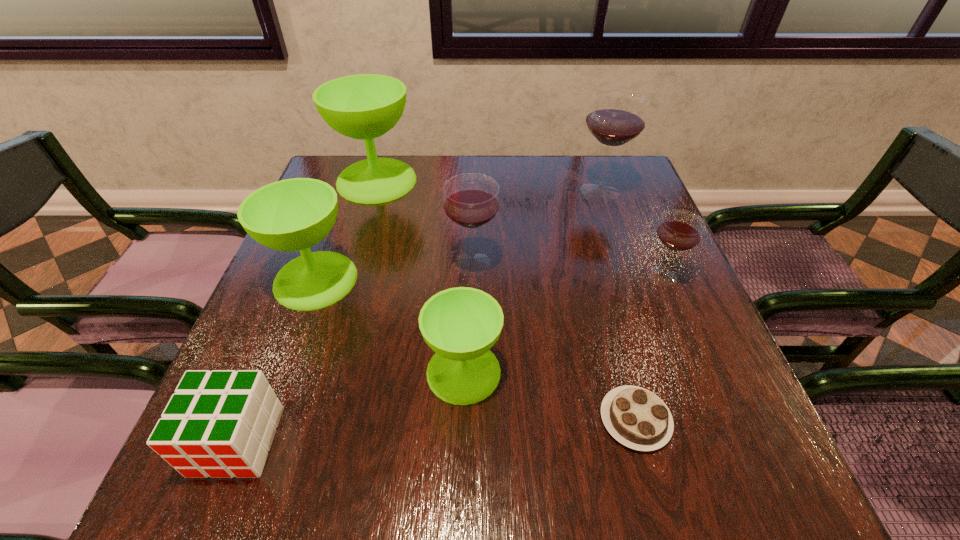
I want to click on the farthest red wineglass, so click(x=616, y=117).

The height and width of the screenshot is (540, 960). What are the coordinates of `the farthest green wineglass` in the screenshot? It's located at (365, 106).

Image resolution: width=960 pixels, height=540 pixels. Find the location of `the second smallest red wineglass`. the second smallest red wineglass is located at coordinates (471, 201).

Locate an element on the screen. the second biggest green wineglass is located at coordinates (295, 214).

The width and height of the screenshot is (960, 540). I want to click on the smallest red wineglass, so click(x=680, y=230).

Identify the location of the nearest green wineglass. The image size is (960, 540). (461, 324).

Identify the location of the rightmost green wineglass. (461, 324).

This screenshot has height=540, width=960. What are the coordinates of `cube` in the screenshot? It's located at (221, 423).

Identify the location of the seventh tallest object. (221, 423).

Where is `chocolate cake`? Image resolution: width=960 pixels, height=540 pixels. chocolate cake is located at coordinates (637, 418).